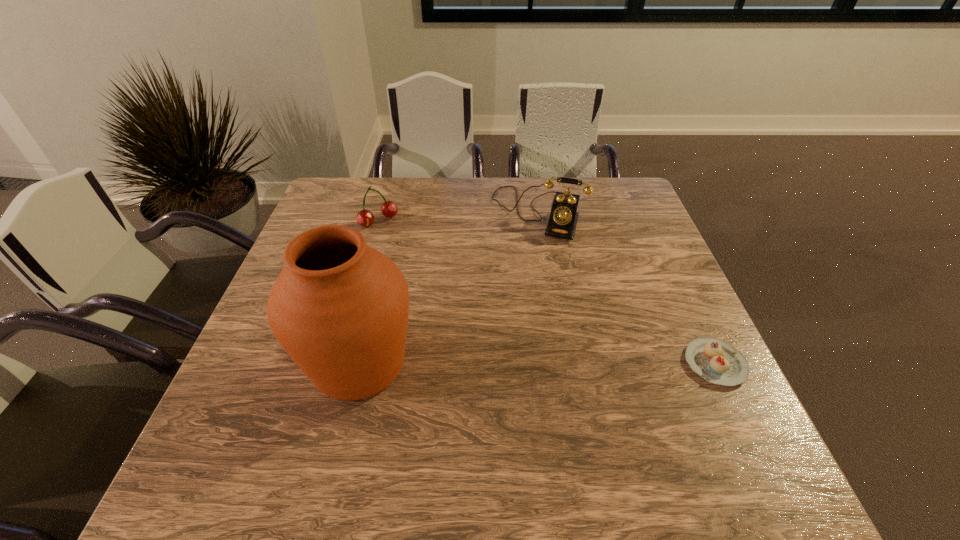
At what (x,y) coordinates should I click in order to perform the action: click on vacant space on the desktop that is between the tallest object and the rightmost object and is positioned on the dial of the second object from right to left. Please return your answer as a coordinate pair (x, y). The height and width of the screenshot is (540, 960). Looking at the image, I should click on (488, 363).

Image resolution: width=960 pixels, height=540 pixels. What are the coordinates of `vacant space on the desktop that is between the urn and the shortest object and is positioned with stems pointing upwards on the cherry` in the screenshot? It's located at (502, 363).